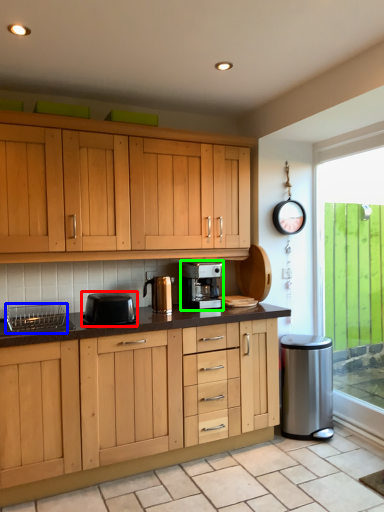
Question: Based on their relative distances, which object is nearer to kitchen appliance (highlighted by a red box)? Choose from appliance (highlighted by a blue box) and home appliance (highlighted by a green box).

Choices:
 (A) appliance
 (B) home appliance

Answer: (A)